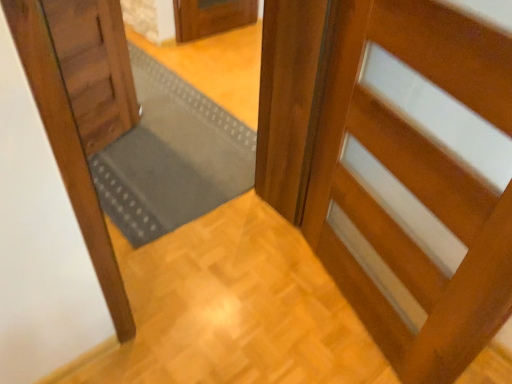
Question: Is wooden door at left, positioned as the second door in right-to-left order, at the left side of glossy wood door at right, positioned as the 2th door in left-to-right order?

Choices:
 (A) no
 (B) yes

Answer: (B)

Question: Is wooden door at left, placed as the 1th door when sorted from left to right, bigger than glossy wood door at right, positioned as the 2th door in left-to-right order?

Choices:
 (A) no
 (B) yes

Answer: (A)

Question: Is the depth of wooden door at left, positioned as the second door in right-to-left order, less than that of glossy wood door at right, the first door positioned from the right?

Choices:
 (A) yes
 (B) no

Answer: (B)

Question: Is wooden door at left, positioned as the second door in right-to-left order, aimed at glossy wood door at right, the first door positioned from the right?

Choices:
 (A) no
 (B) yes

Answer: (B)

Question: Is wooden door at left, placed as the 1th door when sorted from left to right, smaller than glossy wood door at right, positioned as the 2th door in left-to-right order?

Choices:
 (A) no
 (B) yes

Answer: (B)

Question: In the image, is wooden door at left, placed as the 1th door when sorted from left to right, on the left side or the right side of gray rubber doormat at center?

Choices:
 (A) right
 (B) left

Answer: (B)

Question: Is wooden door at left, placed as the 1th door when sorted from left to right, wider or thinner than gray rubber doormat at center?

Choices:
 (A) thin
 (B) wide

Answer: (A)

Question: Relative to gray rubber doormat at center, is wooden door at left, positioned as the second door in right-to-left order, in front or behind?

Choices:
 (A) front
 (B) behind

Answer: (A)

Question: From a real-world perspective, is wooden door at left, placed as the 1th door when sorted from left to right, positioned above or below gray rubber doormat at center?

Choices:
 (A) below
 (B) above

Answer: (B)

Question: Does point 79,61 appear closer or farther from the camera than point 450,359?

Choices:
 (A) closer
 (B) farther

Answer: (B)

Question: Is wooden door at left, placed as the 1th door when sorted from left to right, bigger or smaller than glossy wood door at right, positioned as the 2th door in left-to-right order?

Choices:
 (A) small
 (B) big

Answer: (A)

Question: Is wooden door at left, placed as the 1th door when sorted from left to right, inside or outside of glossy wood door at right, the first door positioned from the right?

Choices:
 (A) inside
 (B) outside

Answer: (B)

Question: Relative to glossy wood door at right, positioned as the 2th door in left-to-right order, is wooden door at left, positioned as the second door in right-to-left order, in front or behind?

Choices:
 (A) behind
 (B) front

Answer: (A)

Question: From a real-world perspective, is glossy wood door at right, the first door positioned from the right, above or below wooden door at left, positioned as the second door in right-to-left order?

Choices:
 (A) above
 (B) below

Answer: (A)

Question: In terms of size, does glossy wood door at right, positioned as the 2th door in left-to-right order, appear bigger or smaller than wooden door at left, positioned as the second door in right-to-left order?

Choices:
 (A) big
 (B) small

Answer: (A)